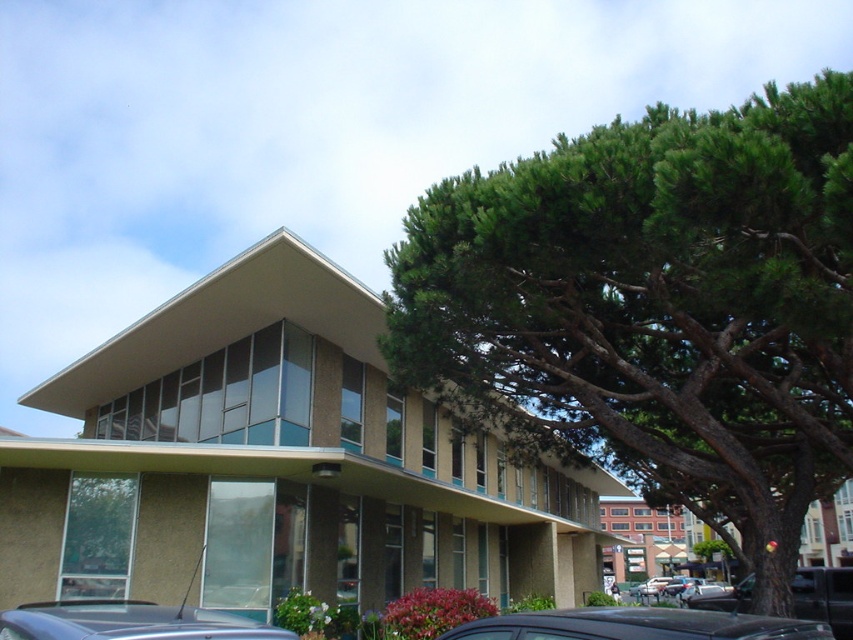
Does point (654, 214) come closer to viewer compared to point (532, 621)?

No, (654, 214) is further to viewer.

Is green leafy tree at upper right wider than black matte car at lower center?

Yes, green leafy tree at upper right is wider than black matte car at lower center.

Is point (581, 342) positioned before point (459, 625)?

That is True.

Find the location of `green leafy tree at upper right`. green leafy tree at upper right is located at coordinates (654, 307).

Is black matte car at lower center thinner than metallic gray car at lower left?

Incorrect, black matte car at lower center's width is not less than metallic gray car at lower left's.

This screenshot has width=853, height=640. What do you see at coordinates (637, 625) in the screenshot? I see `black matte car at lower center` at bounding box center [637, 625].

Find the location of a particular element. black matte car at lower center is located at coordinates (637, 625).

Between green leafy tree at upper right and metallic gray car at lower left, which one is positioned lower?

metallic gray car at lower left is lower down.

What do you see at coordinates (654, 307) in the screenshot? I see `green leafy tree at upper right` at bounding box center [654, 307].

Is point (828, 106) more distant than point (26, 628)?

Yes, it is.

You are a GUI agent. You are given a task and a screenshot of the screen. Output one action in this format:
    pyautogui.click(x=<x>, y=<y>)
    Task: Click on the green leafy tree at upper right
    
    Given the screenshot: What is the action you would take?
    pyautogui.click(x=654, y=307)